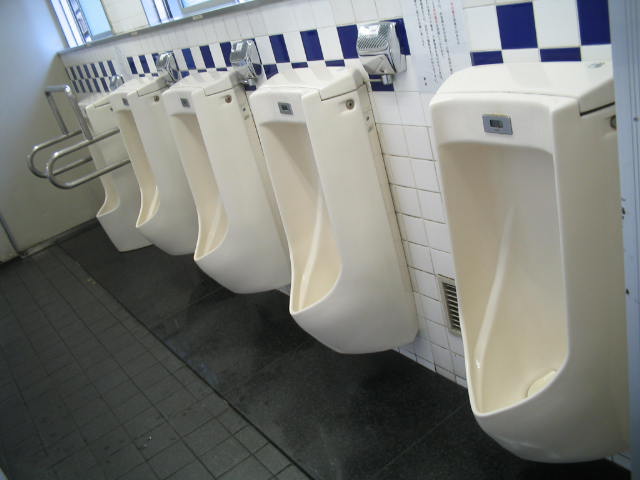
Locate an element on the screen. top of urinals is located at coordinates (93, 100), (125, 89), (192, 84), (292, 86), (512, 94).